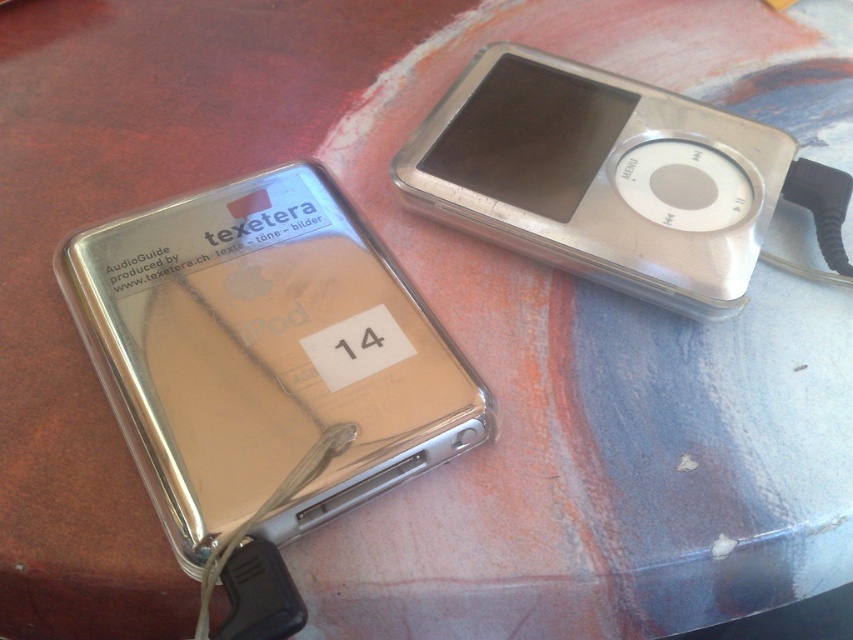
Question: Considering the relative positions of satin gold ipod at center and silver metallic ipod at upper right in the image provided, where is satin gold ipod at center located with respect to silver metallic ipod at upper right?

Choices:
 (A) above
 (B) below

Answer: (B)

Question: Considering the relative positions of satin gold ipod at center and silver metallic ipod at upper right in the image provided, where is satin gold ipod at center located with respect to silver metallic ipod at upper right?

Choices:
 (A) below
 (B) above

Answer: (A)

Question: Which object is farther from the camera taking this photo?

Choices:
 (A) silver metallic ipod at upper right
 (B) satin gold ipod at center

Answer: (A)

Question: Is satin gold ipod at center further to camera compared to silver metallic ipod at upper right?

Choices:
 (A) yes
 (B) no

Answer: (B)